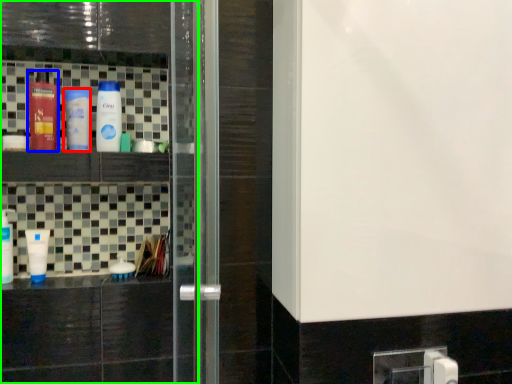
Question: Considering the real-world distances, which object is closest to bottle (highlighted by a red box)? bottle (highlighted by a blue box) or screen door (highlighted by a green box).

Choices:
 (A) bottle
 (B) screen door

Answer: (A)